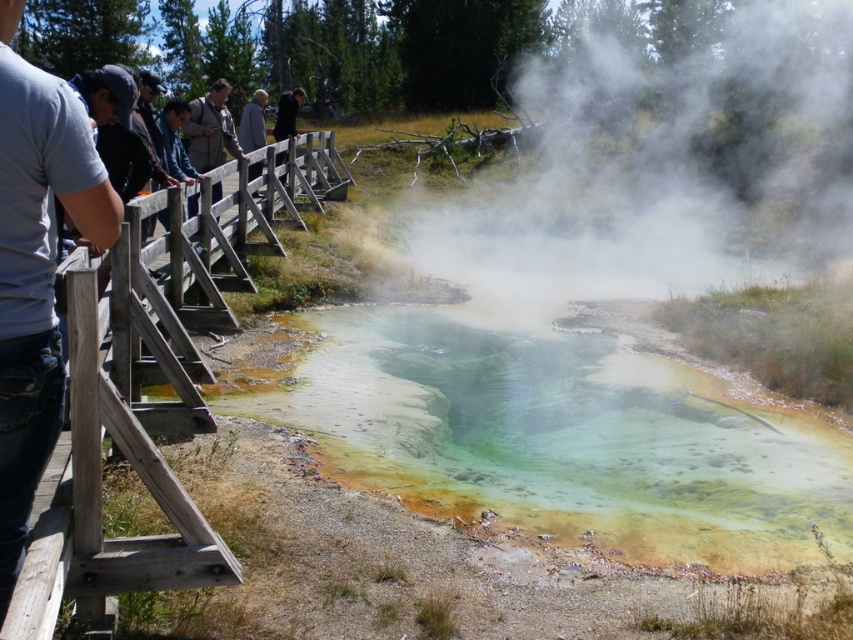
You are standing on the wooden walkway around the geothermal pool. There is a point marked as point [561,435] in the scene. What does this point represent?

The point [561,435] represents the location of the green sedimentary water at center.